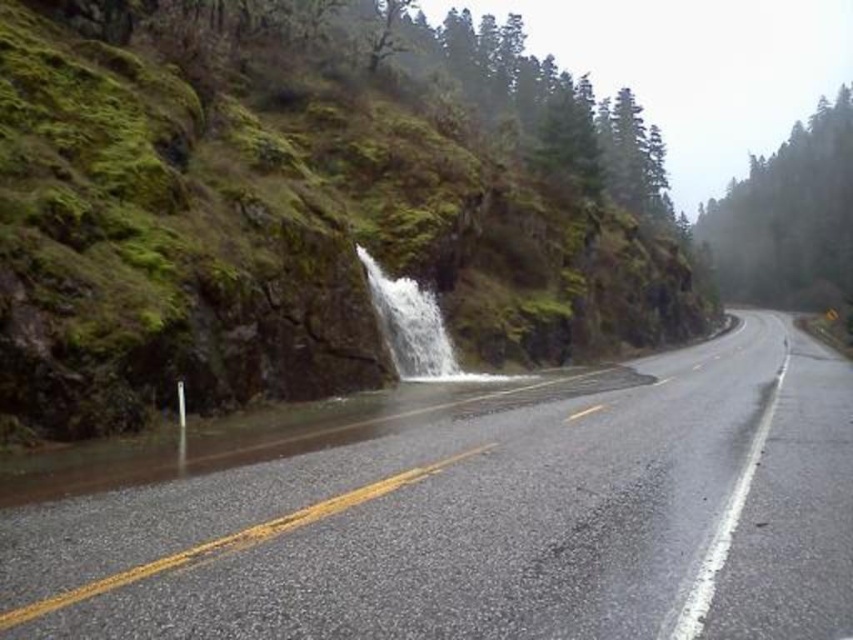
You are a hiker who wants to cross the road to reach the waterfall. There are two obstacles in the road center area, a green mossy rock at center and clear water at center. Which obstacle is closer to the left side of the road?

The clear water at center is closer to the left side of the road because the green mossy rock at center is positioned on the right side of it.

You are driving along the wet road with a yellow dividing line and see two points on the road ahead. The first point is at coordinates point (717,422) and the second is at point (459,378). Which point is closer to your current position?

Point (459,378) is closer to your current position because it is behind point (717,422), which is in front of it.

You are a delivery driver approaching a wet two lane road with a yellow dividing line. You see a green mossy rock at center and a glossy asphalt highway at center. Which object is higher in elevation?

The green mossy rock at center is above the glossy asphalt highway at center, so the green mossy rock at center is higher in elevation.